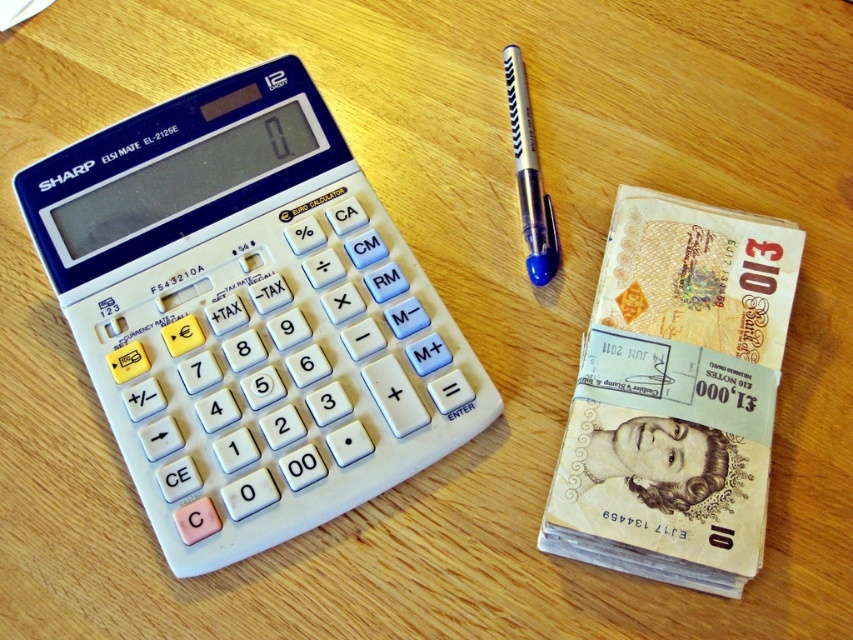
You are taking a photo of the wooden surface and want to ensure both the point at (166, 496) and the point at (633, 232) are in focus. Which point is closer to the camera and should be prioritized for focus?

Point at (166, 496) is closer to the camera than point at (633, 232), so prioritize focusing on point at (166, 496).

You are a cashier who needs to locate the calculator to compute the total cost of an item. Where is the white plastic calculator at left located on the wooden surface?

The white plastic calculator at left is located at point (248, 316) on the wooden surface.

You are a photographer trying to capture a closeup of the calculator. You notice two points on the wooden surface. The first point is at coordinates point (619, 214) and the second point is at point (541, 193). Which point should you focus on to ensure the calculator is in focus?

You should focus on point (619, 214) because it is closer to the camera than point (541, 193), ensuring the calculator is in focus.